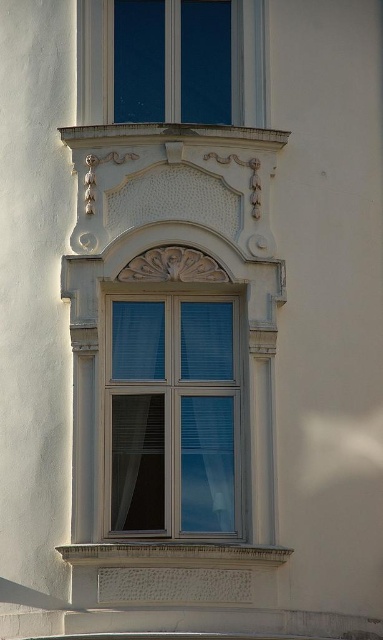
Question: Which point is closer to the camera taking this photo?

Choices:
 (A) (129, 560)
 (B) (145, 320)
 (C) (166, 16)

Answer: (A)

Question: Does matte glass window at center appear on the left side of white textured stone at lower center?

Choices:
 (A) no
 (B) yes

Answer: (A)

Question: Does matte glass window at center appear over matte glass window at upper center?

Choices:
 (A) no
 (B) yes

Answer: (A)

Question: Among these objects, which one is farthest from the camera?

Choices:
 (A) matte glass window at upper center
 (B) matte glass window at center

Answer: (A)

Question: Where is matte glass window at center located in relation to white textured stone at lower center in the image?

Choices:
 (A) left
 (B) right

Answer: (B)

Question: Estimate the real-world distances between objects in this image. Which object is closer to the matte glass window at center?

Choices:
 (A) matte glass window at upper center
 (B) white textured stone at lower center

Answer: (B)